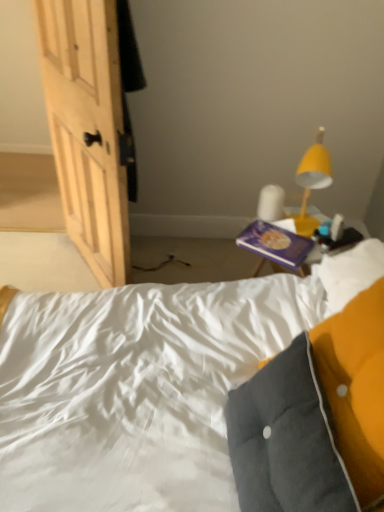
What do you see at coordinates (275, 243) in the screenshot? The width and height of the screenshot is (384, 512). I see `purple matte book at upper right` at bounding box center [275, 243].

Describe the element at coordinates (356, 386) in the screenshot. The width and height of the screenshot is (384, 512). I see `velvety gray pillow at lower right` at that location.

This screenshot has height=512, width=384. Identify the location of purple matte book at upper right. (275, 243).

What's the angular difference between velvety gray pillow at lower right and purple matte book at upper right's facing directions?

The angular difference between velvety gray pillow at lower right and purple matte book at upper right is 49.5 degrees.

Between velvety gray pillow at lower right and purple matte book at upper right, which one is positioned behind?

purple matte book at upper right.

How much distance is there between velvety gray pillow at lower right and purple matte book at upper right?

velvety gray pillow at lower right and purple matte book at upper right are 23.66 inches apart.

Can you confirm if velvety gray pillow at lower right is bigger than purple matte book at upper right?

Yes, velvety gray pillow at lower right is bigger than purple matte book at upper right.

Can you tell me how much yellow matte lamp at upper right and purple matte book at upper right differ in facing direction?

There is a 70.3-degree angle between the facing directions of yellow matte lamp at upper right and purple matte book at upper right.

Considering the positions of objects yellow matte lamp at upper right and purple matte book at upper right in the image provided, who is in front, yellow matte lamp at upper right or purple matte book at upper right?

yellow matte lamp at upper right is in front.

Would you say yellow matte lamp at upper right is a long distance from purple matte book at upper right?

No, yellow matte lamp at upper right is in close proximity to purple matte book at upper right.

Which of these two, purple matte book at upper right or yellow matte lamp at upper right, is bigger?

yellow matte lamp at upper right.

Is purple matte book at upper right looking in the opposite direction of yellow matte lamp at upper right?

No, yellow matte lamp at upper right is not at the back of purple matte book at upper right.

Consider the image. Is purple matte book at upper right shorter than yellow matte lamp at upper right?

Indeed, purple matte book at upper right has a lesser height compared to yellow matte lamp at upper right.

Consider the image. From the image's perspective, would you say purple matte book at upper right is positioned over yellow matte lamp at upper right?

No, from the image's perspective, purple matte book at upper right is not above yellow matte lamp at upper right.

Relative to yellow matte lamp at upper right, is velvety gray pillow at lower right in front or behind?

In the image, velvety gray pillow at lower right appears in front of yellow matte lamp at upper right.

Considering the positions of objects velvety gray pillow at lower right and yellow matte lamp at upper right in the image provided, who is more to the left, velvety gray pillow at lower right or yellow matte lamp at upper right?

velvety gray pillow at lower right is more to the left.

Considering the sizes of velvety gray pillow at lower right and yellow matte lamp at upper right in the image, is velvety gray pillow at lower right wider or thinner than yellow matte lamp at upper right?

In the image, velvety gray pillow at lower right appears to be wider than yellow matte lamp at upper right.

Is yellow matte lamp at upper right located outside velvety gray pillow at lower right?

Yes, yellow matte lamp at upper right is outside of velvety gray pillow at lower right.

In the scene shown: Which object is positioned more to the left, yellow matte lamp at upper right or velvety gray pillow at lower right?

velvety gray pillow at lower right is more to the left.

From a real-world perspective, is yellow matte lamp at upper right above or below velvety gray pillow at lower right?

yellow matte lamp at upper right is above velvety gray pillow at lower right.

Is point (313, 217) positioned after point (347, 456)?

Yes.

Which object is wider, purple matte book at upper right or velvety gray pillow at lower right?

With larger width is velvety gray pillow at lower right.

Which of these two, purple matte book at upper right or velvety gray pillow at lower right, stands shorter?

purple matte book at upper right.

This screenshot has width=384, height=512. I want to click on pillow that appears above the purple matte book at upper right (from a real-world perspective), so click(x=356, y=386).

Is purple matte book at upper right behind velvety gray pillow at lower right?

Yes, purple matte book at upper right is behind velvety gray pillow at lower right.

Identify the location of pillow in front of the purple matte book at upper right. (356, 386).

Where is `lamp on the right side of purple matte book at upper right`? Image resolution: width=384 pixels, height=512 pixels. lamp on the right side of purple matte book at upper right is located at coordinates (312, 181).

When comparing their distances from yellow matte lamp at upper right, does velvety gray pillow at lower right or purple matte book at upper right seem further?

velvety gray pillow at lower right is positioned further to the anchor yellow matte lamp at upper right.

Estimate the real-world distances between objects in this image. Which object is further from yellow matte lamp at upper right, purple matte book at upper right or velvety gray pillow at lower right?

velvety gray pillow at lower right is further to yellow matte lamp at upper right.

From the image, which object appears to be farther from purple matte book at upper right, velvety gray pillow at lower right or yellow matte lamp at upper right?

velvety gray pillow at lower right.

Estimate the real-world distances between objects in this image. Which object is further from velvety gray pillow at lower right, yellow matte lamp at upper right or purple matte book at upper right?

Among the two, yellow matte lamp at upper right is located further to velvety gray pillow at lower right.

Considering their positions, is purple matte book at upper right positioned further to velvety gray pillow at lower right than yellow matte lamp at upper right?

yellow matte lamp at upper right.

Estimate the real-world distances between objects in this image. Which object is closer to purple matte book at upper right, yellow matte lamp at upper right or velvety gray pillow at lower right?

yellow matte lamp at upper right is closer to purple matte book at upper right.

Locate an element on the screen. The width and height of the screenshot is (384, 512). lamp positioned between velvety gray pillow at lower right and purple matte book at upper right from near to far is located at coordinates (312, 181).